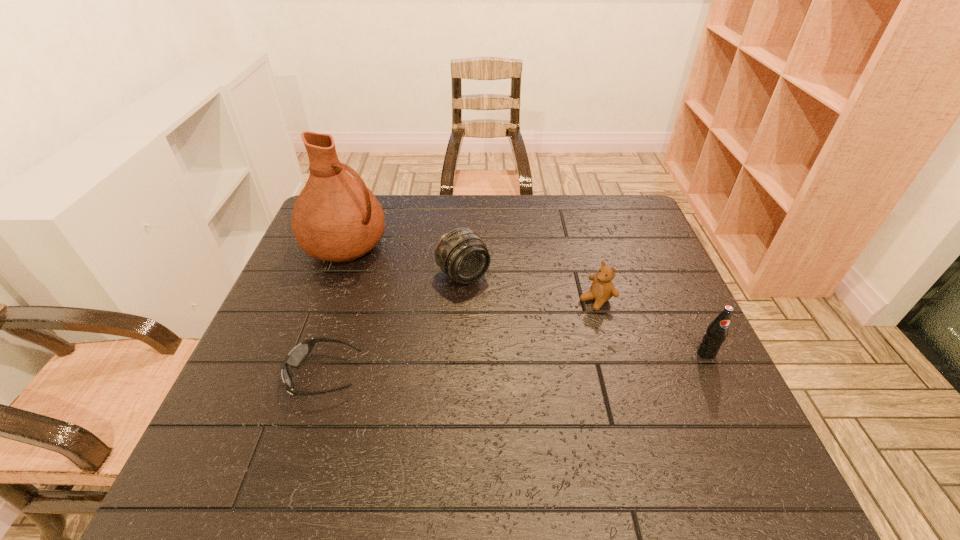
You are a GUI agent. You are given a task and a screenshot of the screen. Output one action in this format:
    pyautogui.click(x=<x>, y=<y>)
    Task: Click on the object situated at the right edge
    The height and width of the screenshot is (540, 960).
    Given the screenshot: What is the action you would take?
    pyautogui.click(x=716, y=332)

Identify the location of object positioned at the far left corner. Image resolution: width=960 pixels, height=540 pixels. (336, 218).

You are a GUI agent. You are given a task and a screenshot of the screen. Output one action in this format:
    pyautogui.click(x=<x>, y=<y>)
    Task: Click on the object that is at the near left corner
    
    Given the screenshot: What is the action you would take?
    pyautogui.click(x=298, y=354)

Locate an element on the screen. The width and height of the screenshot is (960, 540). vacant space at the far edge is located at coordinates (498, 204).

Locate an element on the screen. This screenshot has height=540, width=960. vacant region at the near edge of the desktop is located at coordinates (530, 415).

In the image, there is a desktop. At what (x,y) coordinates should I click in order to perform the action: click on vacant space at the left edge. Please return your answer as a coordinate pair (x, y). Looking at the image, I should click on (315, 289).

Where is `vacant area at the right edge`? vacant area at the right edge is located at coordinates (630, 299).

The width and height of the screenshot is (960, 540). I want to click on free space that is in between the sunglasses and the rightmost object, so click(x=516, y=364).

The width and height of the screenshot is (960, 540). I want to click on free space between the third object from left to right and the teddy bear, so click(530, 287).

You are a GUI agent. You are given a task and a screenshot of the screen. Output one action in this format:
    pyautogui.click(x=<x>, y=<y>)
    Task: Click on the free space between the fourth tallest object and the third object from right to left
    The height and width of the screenshot is (540, 960).
    Given the screenshot: What is the action you would take?
    pyautogui.click(x=530, y=287)